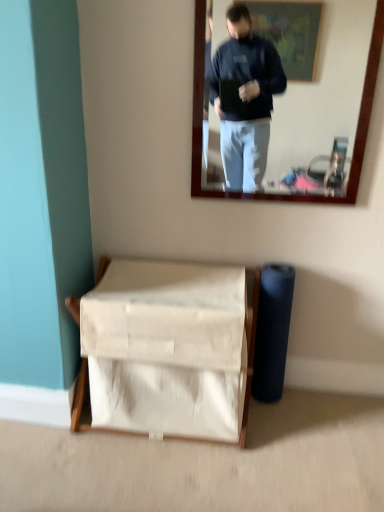
Question: Does point click(137, 343) appear closer or farther from the camera than point click(354, 180)?

Choices:
 (A) closer
 (B) farther

Answer: (A)

Question: Is white fabric basket at lower center wider or thinner than matte wooden mirror at upper center?

Choices:
 (A) wide
 (B) thin

Answer: (A)

Question: Is white fabric basket at lower center bigger or smaller than matte wooden mirror at upper center?

Choices:
 (A) big
 (B) small

Answer: (A)

Question: In terms of width, does matte wooden mirror at upper center look wider or thinner when compared to white fabric basket at lower center?

Choices:
 (A) wide
 (B) thin

Answer: (B)

Question: In terms of height, does matte wooden mirror at upper center look taller or shorter compared to white fabric basket at lower center?

Choices:
 (A) tall
 (B) short

Answer: (A)

Question: From the image's perspective, is matte wooden mirror at upper center positioned above or below white fabric basket at lower center?

Choices:
 (A) above
 (B) below

Answer: (A)

Question: From a real-world perspective, is matte wooden mirror at upper center physically located above or below white fabric basket at lower center?

Choices:
 (A) below
 (B) above

Answer: (B)